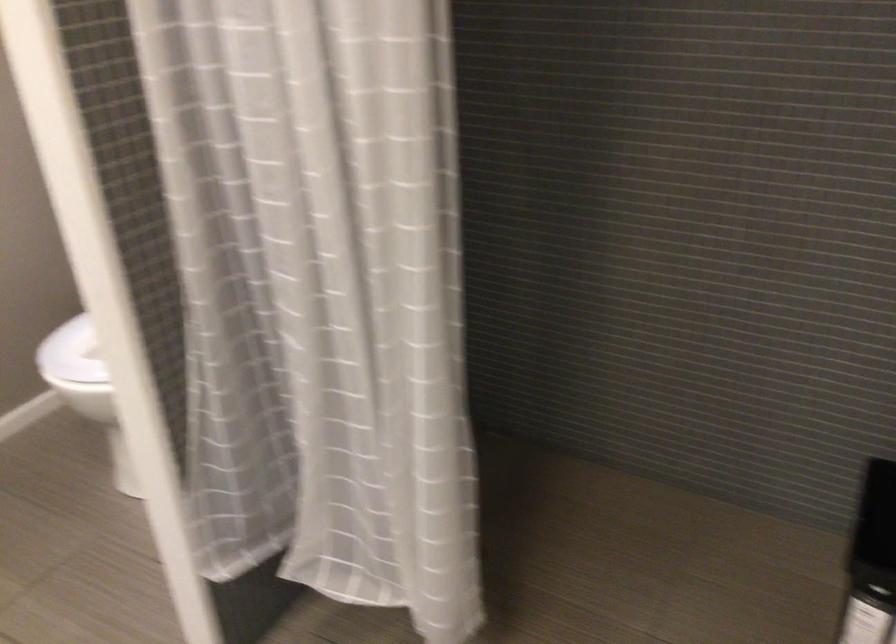
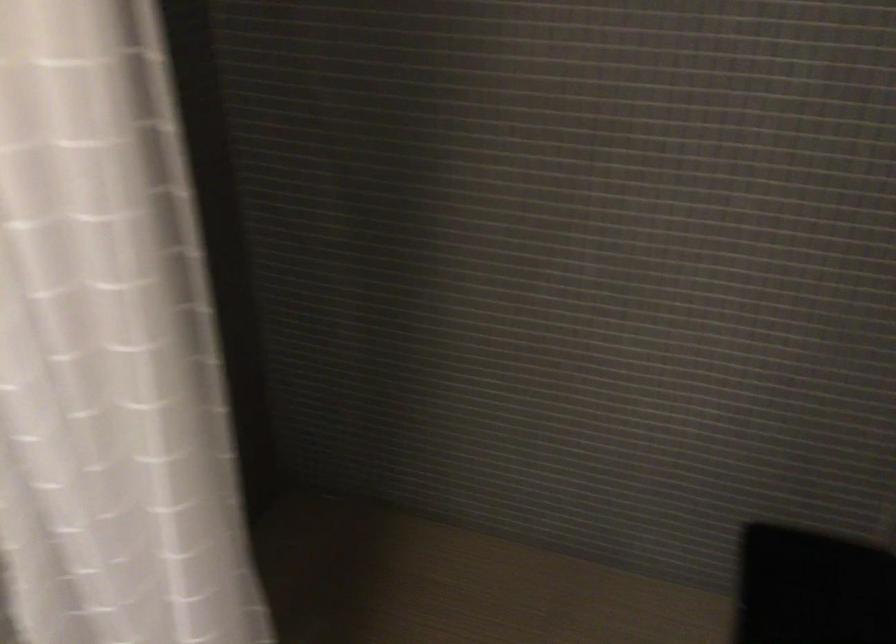
Question: What movement of the cameraman would produce the second image?

Choices:
 (A) Left
 (B) Right
 (C) Forward
 (D) Backward

Answer: (C)